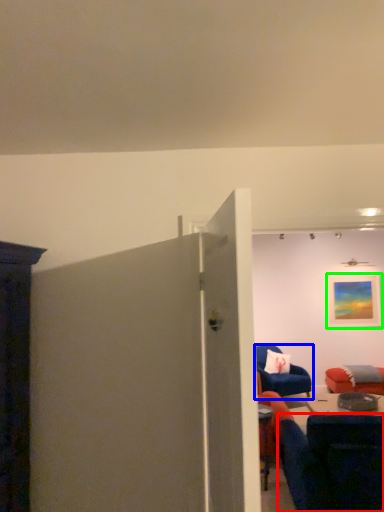
Question: Considering the real-world distances, which object is farthest from chair (highlighted by a red box)? chair (highlighted by a blue box) or picture frame (highlighted by a green box)?

Choices:
 (A) chair
 (B) picture frame

Answer: (B)